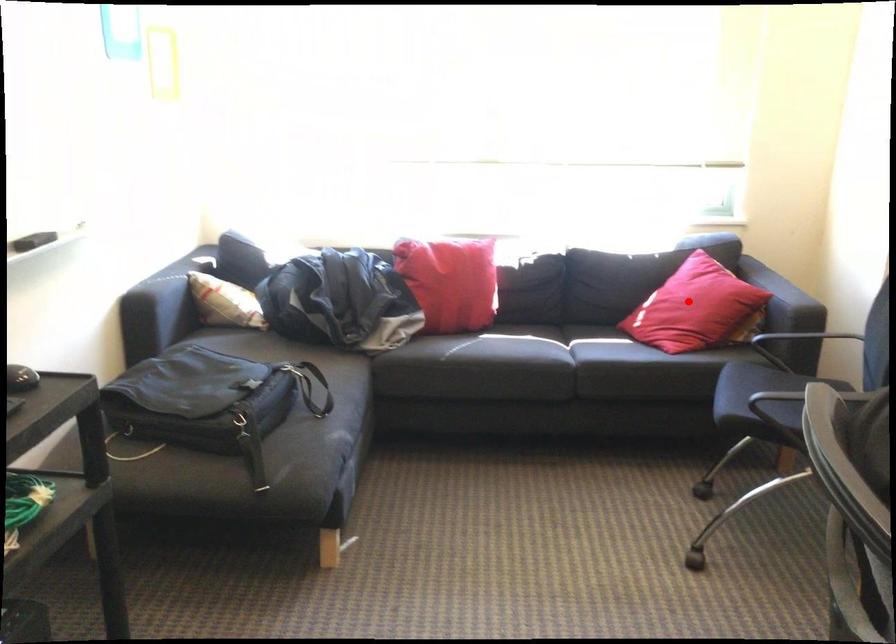
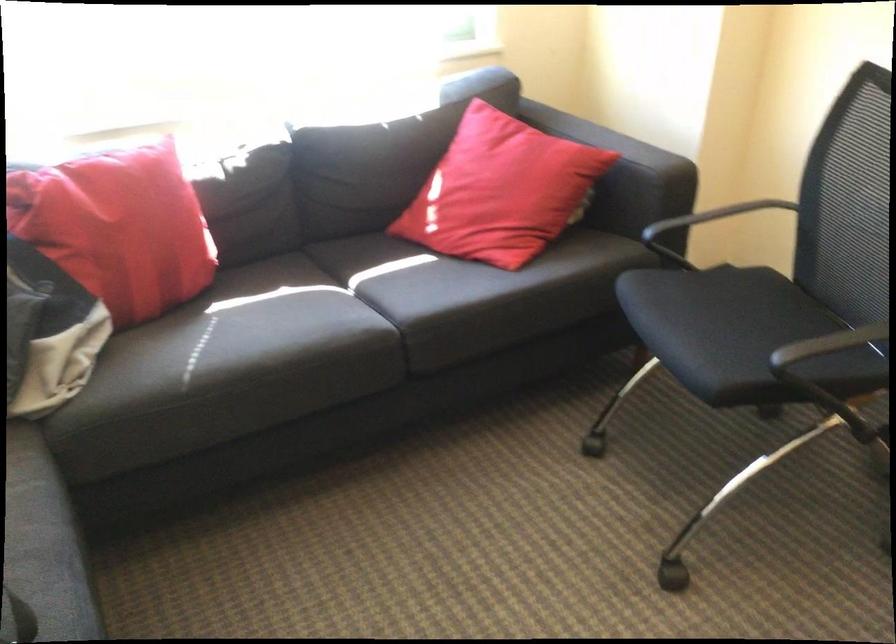
Question: I am providing you with two images of the same scene from different viewpoints. A red point is shown in image1. For the corresponding object point in image2, is it positioned nearer or farther from the camera?

Choices:
 (A) Nearer
 (B) Farther

Answer: (A)